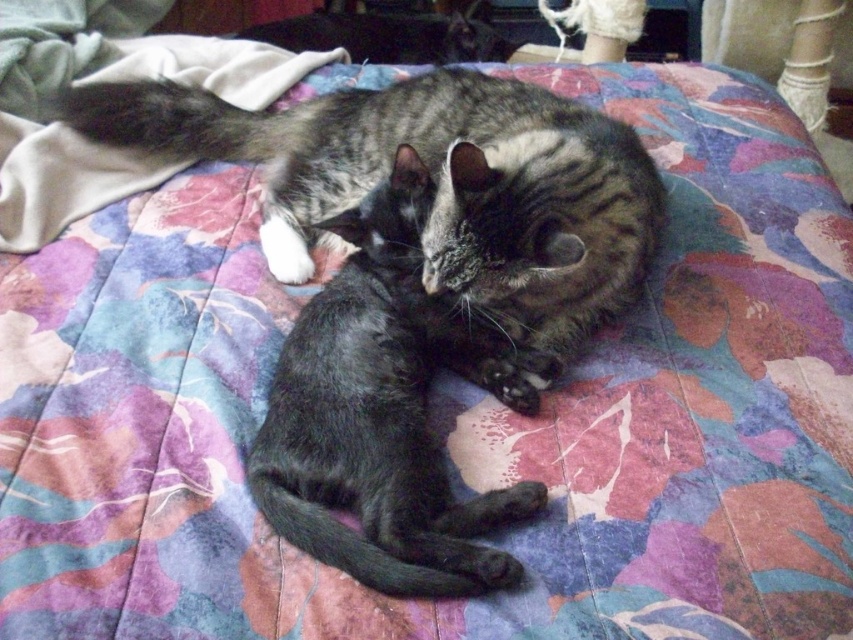
Looking at this image, you are looking at the bed with the colorful quilt. There are two points marked on the bed. The first point is at coordinates point (505, 216) and the second point is at point (299, 355). Which point is closer to you?

A: Point (505, 216) is closer to the viewer than point (299, 355).

You are a photographer trying to capture both cats in a single shot. Given that the shiny black cat at center is smaller than the tabby fur cat at center, which cat should you focus on first to ensure both fit in the frame?

You should focus on the tabby fur cat at center first since it is larger and ensuring it fits properly will help accommodate the smaller shiny black cat at center in the frame.

You are a photographer trying to capture both cats in the image. Since the bed is small, you can only focus on one cat at a time. If you focus on the tabby fur cat at center first, will the shiny black cat at center also be in focus?

The shiny black cat at center is behind the tabby fur cat at center, so if you focus on the tabby fur cat at center first, the shiny black cat at center may not be in focus because it is at a different depth.